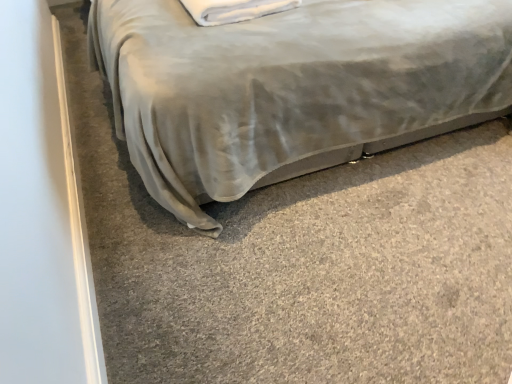
Question: Considering the positions of satin gray bed at center and white soft pillow at upper center in the image, is satin gray bed at center taller or shorter than white soft pillow at upper center?

Choices:
 (A) tall
 (B) short

Answer: (A)

Question: Considering their positions, is satin gray bed at center located in front of or behind white soft pillow at upper center?

Choices:
 (A) behind
 (B) front

Answer: (B)

Question: From the image's perspective, relative to white soft pillow at upper center, is satin gray bed at center above or below?

Choices:
 (A) above
 (B) below

Answer: (A)

Question: In the image, is white soft pillow at upper center on the left side or the right side of satin gray bed at center?

Choices:
 (A) left
 (B) right

Answer: (A)

Question: From a real-world perspective, relative to satin gray bed at center, is white soft pillow at upper center vertically above or below?

Choices:
 (A) below
 (B) above

Answer: (B)

Question: From the image's perspective, relative to satin gray bed at center, is white soft pillow at upper center above or below?

Choices:
 (A) below
 (B) above

Answer: (A)

Question: Looking at their shapes, would you say white soft pillow at upper center is wider or thinner than satin gray bed at center?

Choices:
 (A) wide
 (B) thin

Answer: (B)